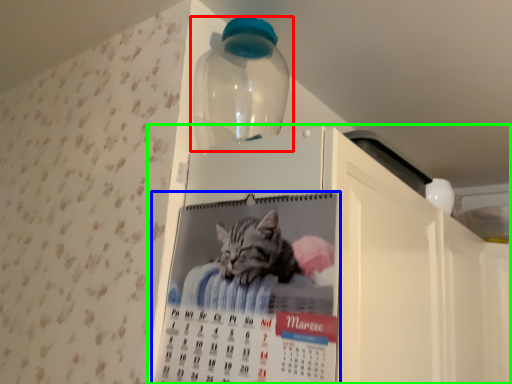
Question: Which object is the closest to the bottle (highlighted by a red box)? Choose among these: poster (highlighted by a blue box) or appliance (highlighted by a green box).

Choices:
 (A) poster
 (B) appliance

Answer: (B)